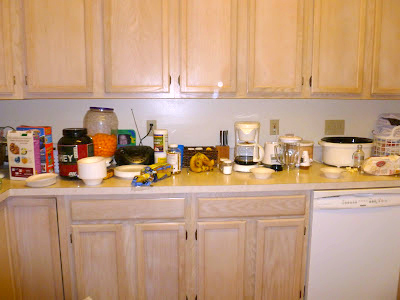
Locate an element on the screen. The height and width of the screenshot is (300, 400). electrical outlet is located at coordinates (153, 126), (272, 126).